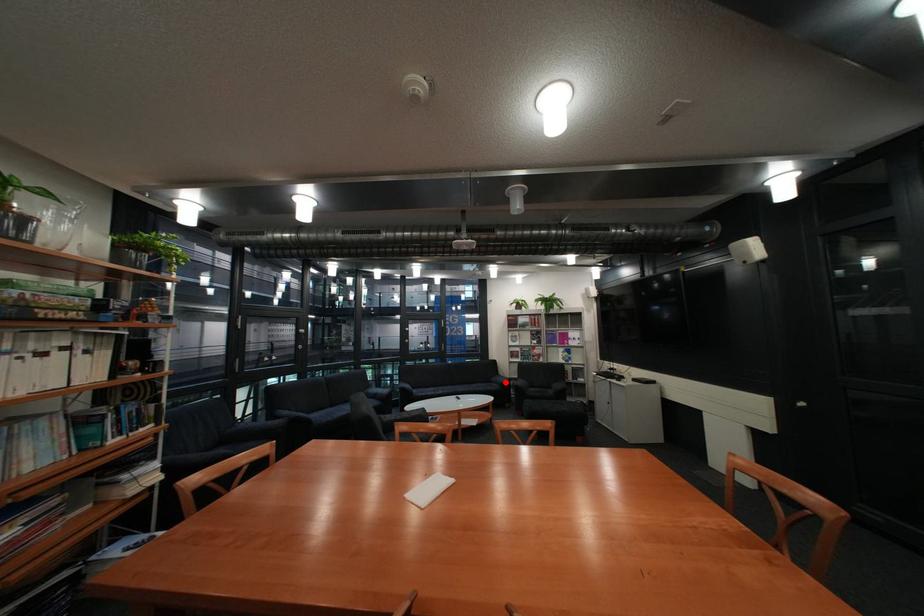
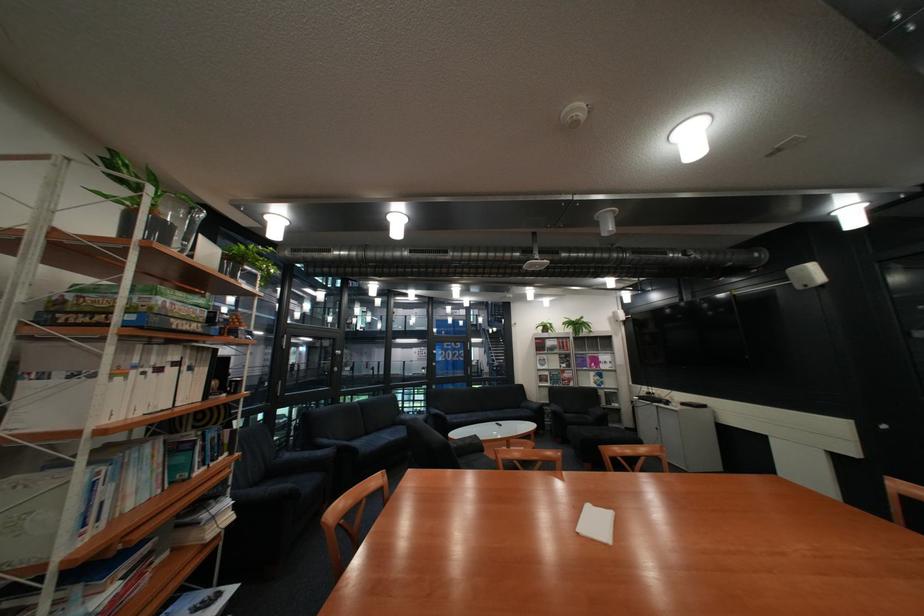
In the second image, find the point that corresponds to the highlighted location in the first image.

(535, 408)